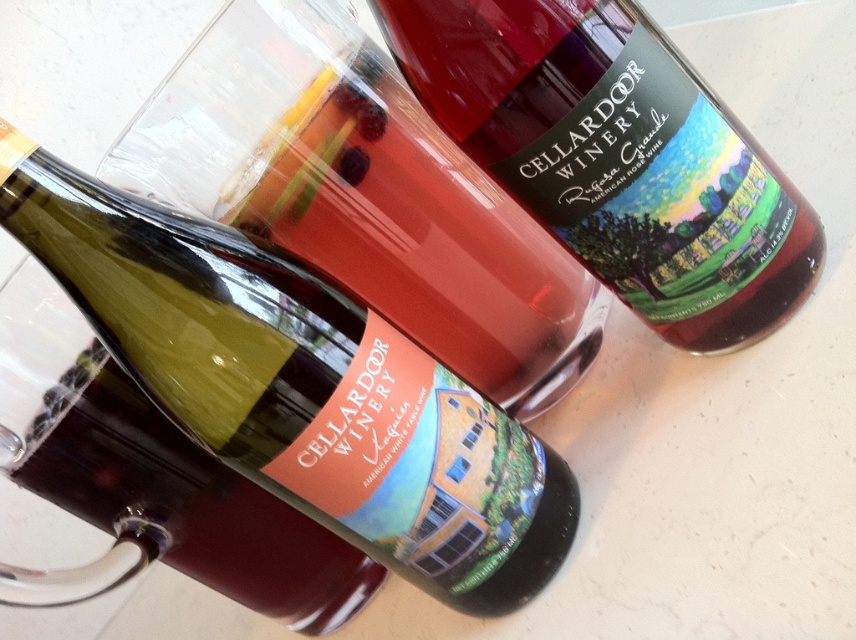
What is located at the coordinates point (301, 387)?

The point (301, 387) is occupied by a matte glass bottle at center.